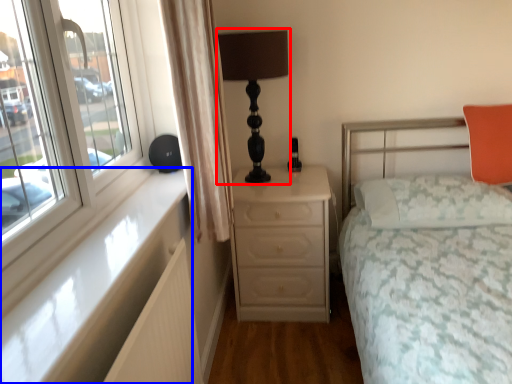
Question: Among these objects, which one is farthest to the camera, table lamp (highlighted by a red box) or window sill (highlighted by a blue box)?

Choices:
 (A) table lamp
 (B) window sill

Answer: (A)